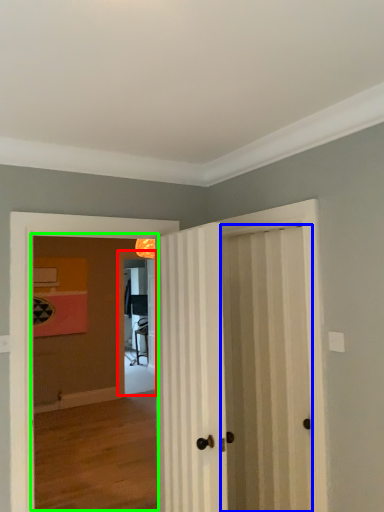
Question: Estimate the real-world distances between objects in this image. Which object is closer to screen door (highlighted by a red box), door (highlighted by a blue box) or corridor (highlighted by a green box)?

Choices:
 (A) door
 (B) corridor

Answer: (B)